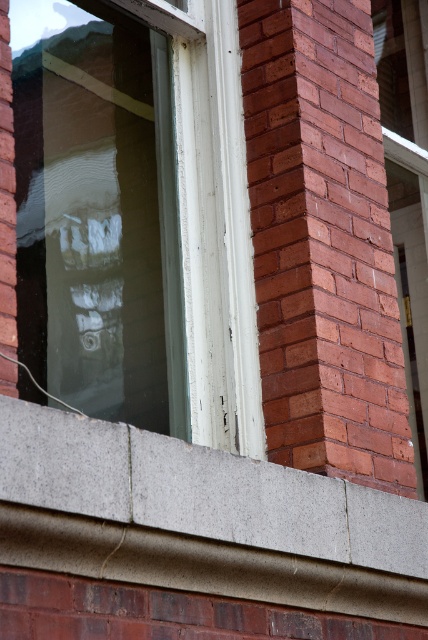
You are a painter assessing the building. You need to know which object is taller between the white painted wood window at center and the smooth concrete ledge at lower center. Can you tell me?

The white painted wood window at center is taller than the smooth concrete ledge at lower center.

In the scene shown: You are an architect assessing the structural integrity of a building. You notice the white painted wood window at center and the smooth concrete ledge at lower center. Which object has a smaller width according to the measurements?

The white painted wood window at center has a smaller width than the smooth concrete ledge at lower center.

You are an architect inspecting the building facade. You need to install a new air conditioner unit that requires a base of at least 1 meter in width. The smooth concrete ledge at lower center is 0.8 meters wide. Can the white painted wood window at center accommodate the unit if it is placed there instead?

The white painted wood window at center has a larger size compared to smooth concrete ledge at lower center. However, the smooth concrete ledge at lower center is only 0.8 meters wide, which is insufficient for the air conditioner unit requiring 1 meter. The question mentions placing the unit at the white painted wood window at center, but the description only compares their sizes without specifying the window ledge dimensions. Therefore, insufficient information is provided to determine if the window area